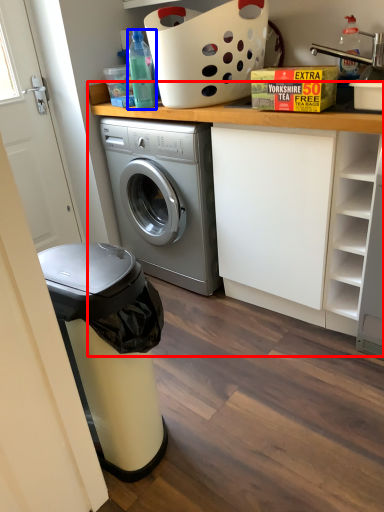
Question: Which object appears closest to the camera in this image, counter (highlighted by a red box) or bottle (highlighted by a blue box)?

Choices:
 (A) counter
 (B) bottle

Answer: (A)